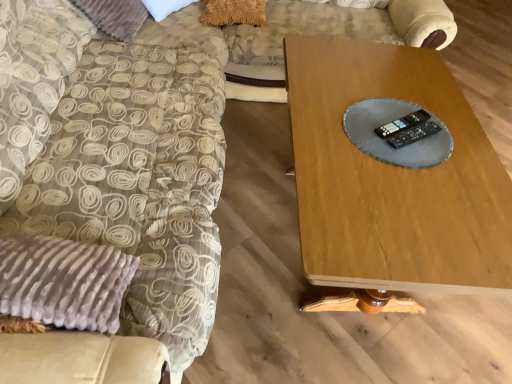
Question: Considering the relative positions of black plastic remote at center, which appears as the second control when ordered from the bottom, and wooden table at center in the image provided, is black plastic remote at center, which appears as the second control when ordered from the bottom, behind wooden table at center?

Choices:
 (A) yes
 (B) no

Answer: (A)

Question: From the image's perspective, does black plastic remote at center, the first control positioned from the top, appear lower than wooden table at center?

Choices:
 (A) yes
 (B) no

Answer: (B)

Question: From the image's perspective, is black plastic remote at center, the first control positioned from the top, above wooden table at center?

Choices:
 (A) yes
 (B) no

Answer: (A)

Question: Is the position of black plastic remote at center, which appears as the second control when ordered from the bottom, less distant than that of wooden table at center?

Choices:
 (A) yes
 (B) no

Answer: (B)

Question: From a real-world perspective, is black plastic remote at center, the first control positioned from the top, positioned above or below wooden table at center?

Choices:
 (A) below
 (B) above

Answer: (B)

Question: Looking at the image, does black plastic remote at center, the first control positioned from the top, seem bigger or smaller compared to wooden table at center?

Choices:
 (A) small
 (B) big

Answer: (A)

Question: Choose the correct answer: Is black plastic remote at center, the first control positioned from the top, inside wooden table at center or outside it?

Choices:
 (A) outside
 (B) inside

Answer: (A)

Question: In terms of width, does black plastic remote at center, which appears as the second control when ordered from the bottom, look wider or thinner when compared to wooden table at center?

Choices:
 (A) wide
 (B) thin

Answer: (B)

Question: Is black plastic remote at center, which is the first control from bottom to top, in front of or behind black plastic remote at center, the first control positioned from the top, in the image?

Choices:
 (A) behind
 (B) front

Answer: (B)

Question: Is point (414, 132) closer or farther from the camera than point (394, 127)?

Choices:
 (A) closer
 (B) farther

Answer: (A)

Question: From the image's perspective, is black plastic remote at center, which is the first control from bottom to top, located above or below black plastic remote at center, which appears as the second control when ordered from the bottom?

Choices:
 (A) above
 (B) below

Answer: (B)

Question: From their relative heights in the image, would you say black plastic remote at center, the 2th control in the top-to-bottom sequence, is taller or shorter than black plastic remote at center, which appears as the second control when ordered from the bottom?

Choices:
 (A) short
 (B) tall

Answer: (B)

Question: Looking at their shapes, would you say velvet beige swivel chair at left is wider or thinner than black plastic remote at center, the 2th control in the top-to-bottom sequence?

Choices:
 (A) wide
 (B) thin

Answer: (A)

Question: From a real-world perspective, is velvet beige swivel chair at left physically located above or below black plastic remote at center, which is the first control from bottom to top?

Choices:
 (A) below
 (B) above

Answer: (A)